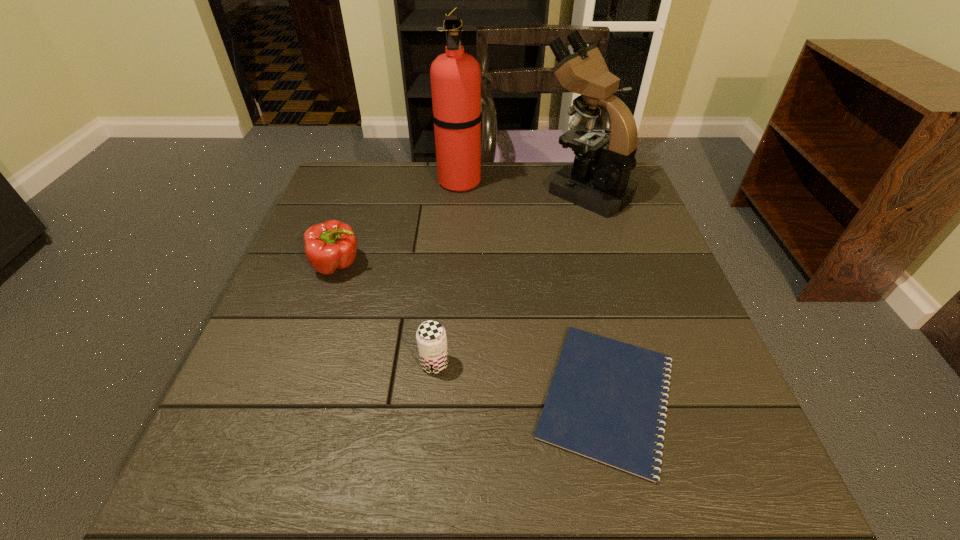
This screenshot has height=540, width=960. What are the coordinates of `fire extinguisher` in the screenshot? It's located at (455, 76).

Where is `microscope`? microscope is located at coordinates (598, 180).

Where is `the leftmost object`? This screenshot has height=540, width=960. the leftmost object is located at coordinates (329, 246).

Where is `pepper`? pepper is located at coordinates (329, 246).

Locate an element on the screen. Image resolution: width=960 pixels, height=540 pixels. beer can is located at coordinates (431, 338).

Where is `notepad`? notepad is located at coordinates (604, 401).

Find the location of `vacant region located 0.270m at the nozzle of the fire extinguisher`. vacant region located 0.270m at the nozzle of the fire extinguisher is located at coordinates (570, 181).

Identify the location of blank space located on the left of the microscope. The height and width of the screenshot is (540, 960). (491, 191).

I want to click on vacant area located on the back of the pepper, so click(x=364, y=190).

This screenshot has height=540, width=960. Identify the location of vacant space situated on the left of the fourth tallest object. (299, 364).